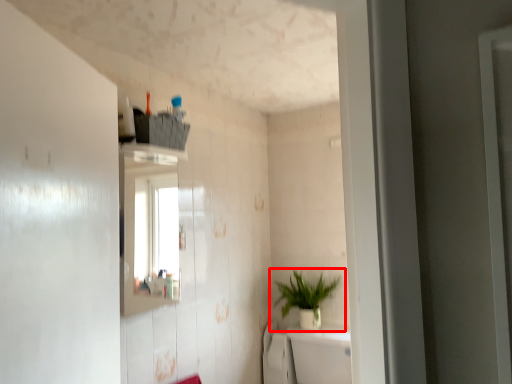
Question: Considering the relative positions of houseplant (annotated by the red box) and bath in the image provided, where is houseplant (annotated by the red box) located with respect to the staircase?

Choices:
 (A) left
 (B) right

Answer: (A)